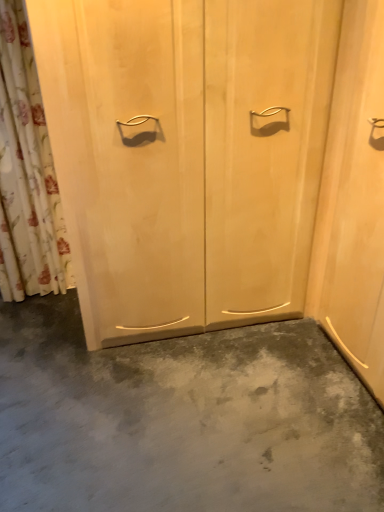
Where is `unoccupied area in front of light wood/texture door at center`? Image resolution: width=384 pixels, height=512 pixels. unoccupied area in front of light wood/texture door at center is located at coordinates (198, 405).